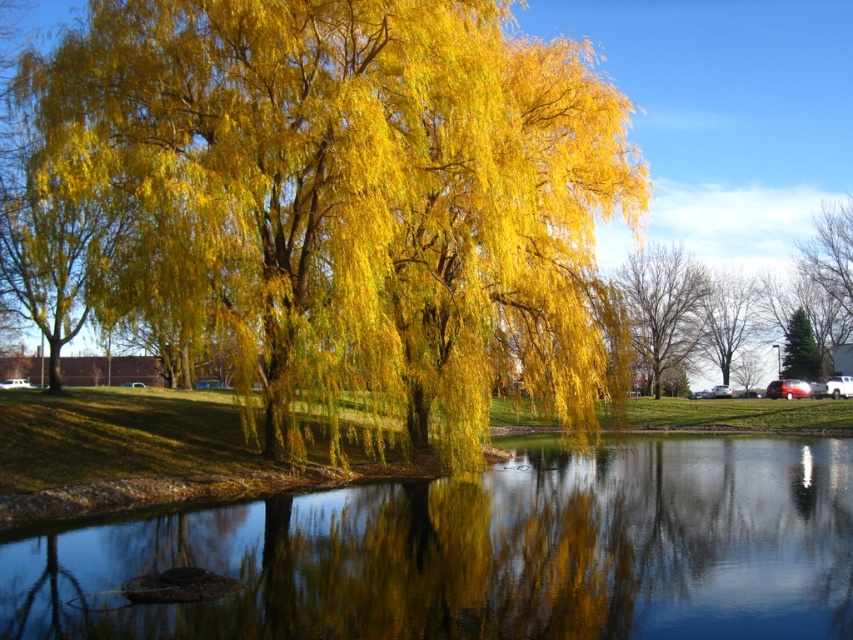
Is bare branches tree at center closer to the viewer compared to smooth bark tree at center?

Yes, bare branches tree at center is in front of smooth bark tree at center.

Measure the distance from bare branches tree at center to smooth bark tree at center.

bare branches tree at center is 5.57 meters away from smooth bark tree at center.

Between point (646, 284) and point (740, 324), which one is positioned in front?

Point (646, 284)

Image resolution: width=853 pixels, height=640 pixels. I want to click on bare branches tree at center, so click(662, 307).

Based on the photo, which is more to the left, smooth reflective water at center or smooth bark tree at center?

Positioned to the left is smooth reflective water at center.

Is smooth reflective water at center in front of smooth bark tree at center?

Yes, smooth reflective water at center is closer to the viewer.

Is point (553, 483) less distant than point (757, 300)?

Yes, point (553, 483) is closer to viewer.

Where is `smooth reflective water at center`? The height and width of the screenshot is (640, 853). smooth reflective water at center is located at coordinates (486, 552).

Which of these two, golden yellow leaves at center or smooth bark tree at center, stands taller?

With more height is golden yellow leaves at center.

Image resolution: width=853 pixels, height=640 pixels. Describe the element at coordinates (347, 200) in the screenshot. I see `golden yellow leaves at center` at that location.

Between point (550, 176) and point (705, 332), which one is positioned behind?

Point (705, 332)

What are the coordinates of `golden yellow leaves at center` in the screenshot? It's located at (347, 200).